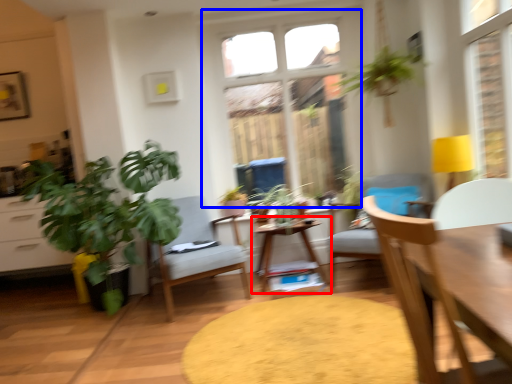
Question: Which point is further to the camera, table (highlighted by a red box) or window (highlighted by a blue box)?

Choices:
 (A) table
 (B) window

Answer: (B)